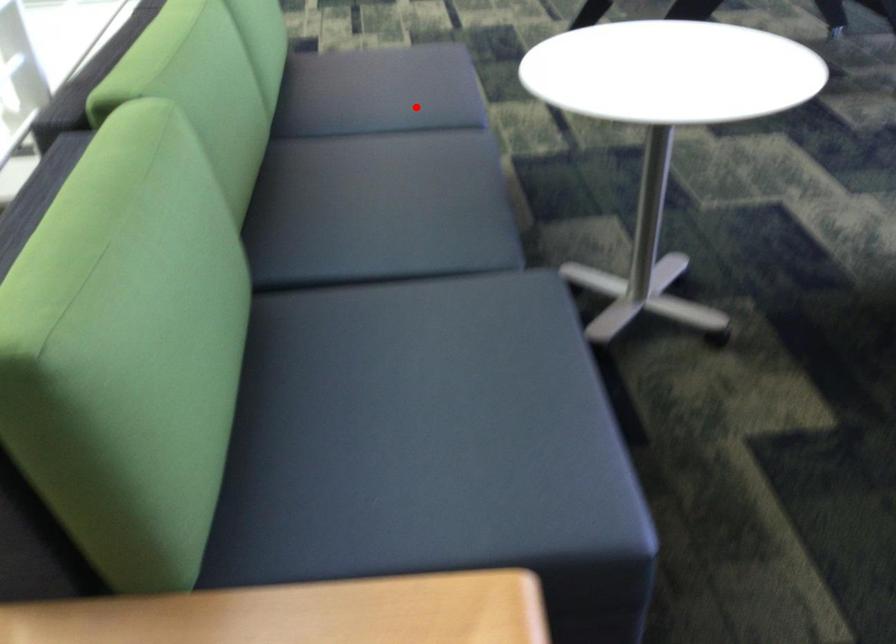
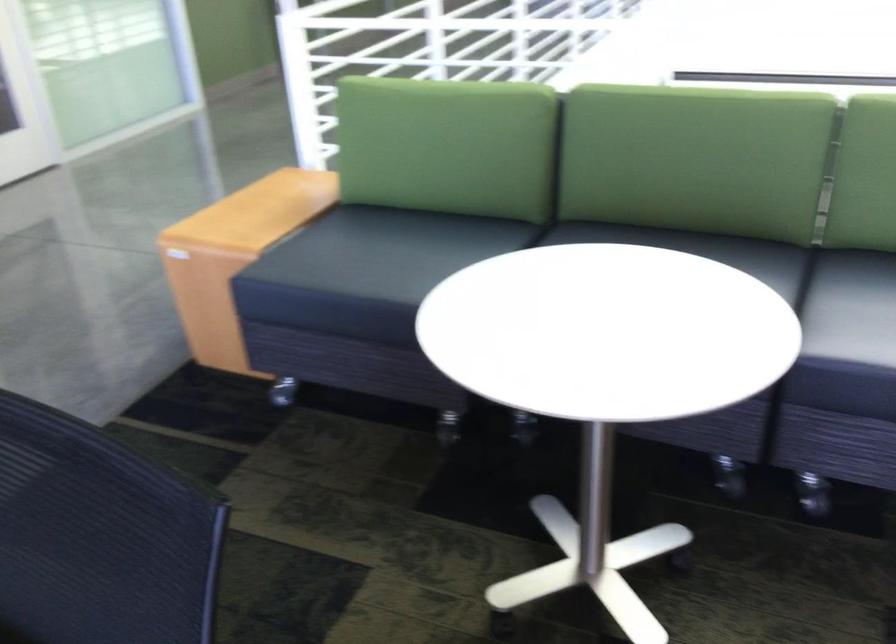
Question: I am providing you with two images of the same scene from different viewpoints. Image1 has a red point marked. In image2, the corresponding 3D location appears at what relative position? Reply with the corresponding letter.

Choices:
 (A) Closer
 (B) Farther

Answer: (A)